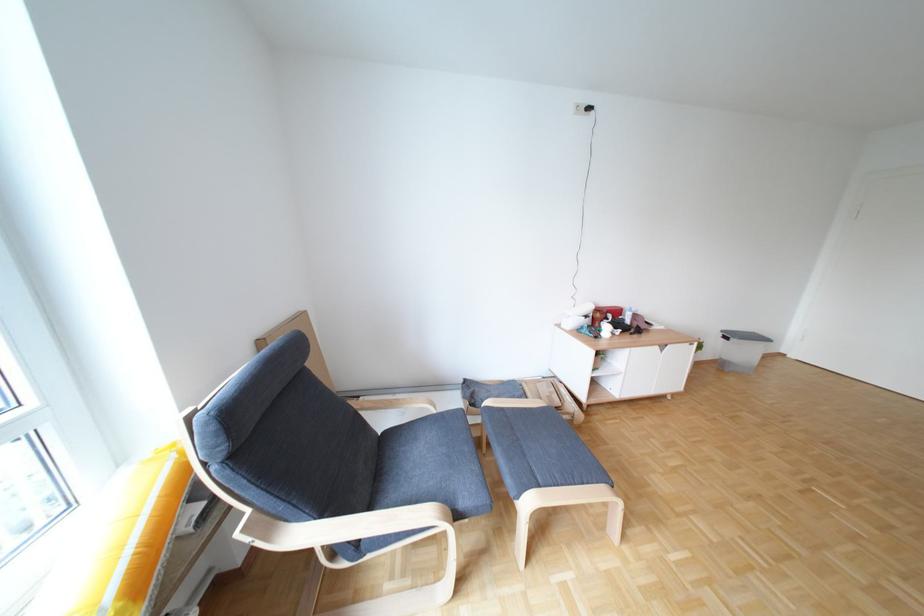
Find where to rest the cushioned footstool surface. Please return your answer as a coordinate pair (x, y).

(539, 450)